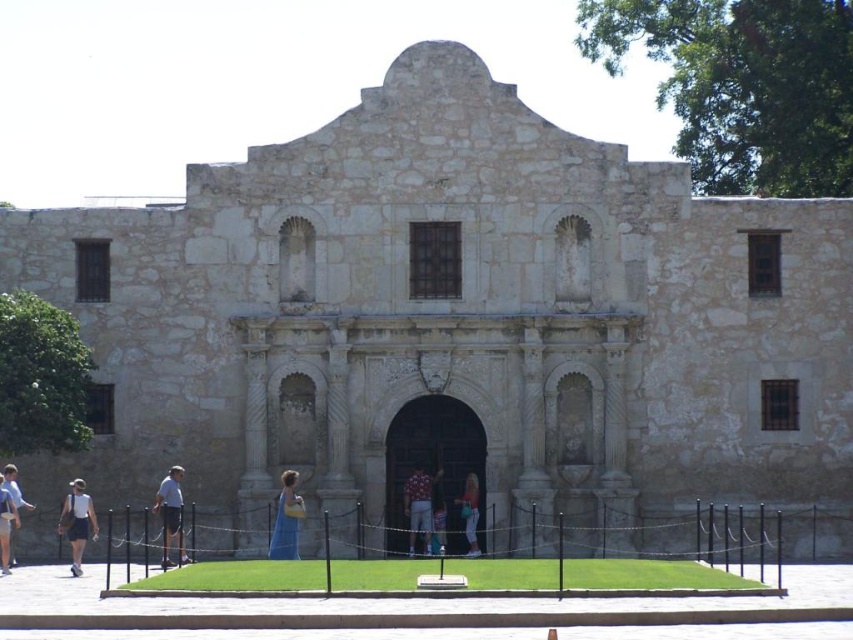
What are the coordinates of the blue denim dress at center in the image?

The blue denim dress at center is located at coordinates point (469, 513).

You are a photographer planning to take a portrait of someone wearing the blue denim dress at center and the matte gray shorts at lower left. Since you want to emphasize the dress, where should you position the person relative to the Alamo building?

To emphasize the blue denim dress at center, position the person closer to the Alamo building so the dress appears larger in the frame compared to the matte gray shorts at lower left.

You are a photographer planning to take a portrait of two friends wearing the blue denim dress at center and the matte white dress at lower left. Since you want to ensure both dresses are visible in the frame, which dress should you position closer to the camera to avoid the other dress blocking it?

You should position the blue denim dress at center closer to the camera because it is under the matte white dress at lower left, so placing it forward will prevent the matte white dress at lower left from blocking it.